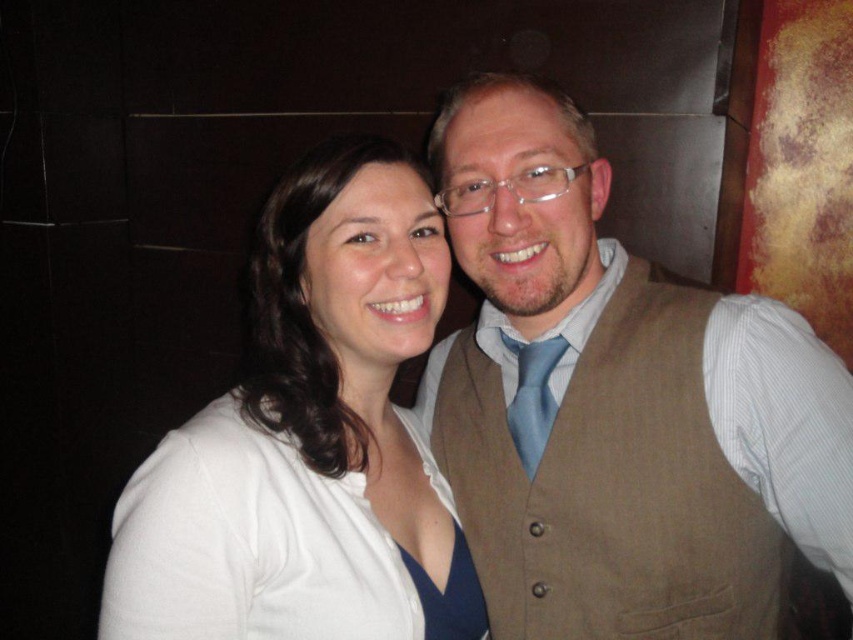
Question: Can you confirm if white matte shirt at center is positioned below light blue silk tie at center?

Choices:
 (A) yes
 (B) no

Answer: (B)

Question: Which point is farther from the camera taking this photo?

Choices:
 (A) (733, 317)
 (B) (543, 419)
 (C) (177, 579)

Answer: (B)

Question: Observing the image, what is the correct spatial positioning of white fabric dress at center in reference to light blue silk tie at center?

Choices:
 (A) right
 (B) left

Answer: (B)

Question: Among these objects, which one is nearest to the camera?

Choices:
 (A) light blue silk tie at center
 (B) white matte shirt at center

Answer: (B)

Question: Can you confirm if brown suede vest at center is thinner than light blue silk tie at center?

Choices:
 (A) no
 (B) yes

Answer: (A)

Question: Which point is closer to the camera?

Choices:
 (A) (401, 476)
 (B) (471, 380)
 (C) (519, 417)
 (D) (158, 484)

Answer: (D)